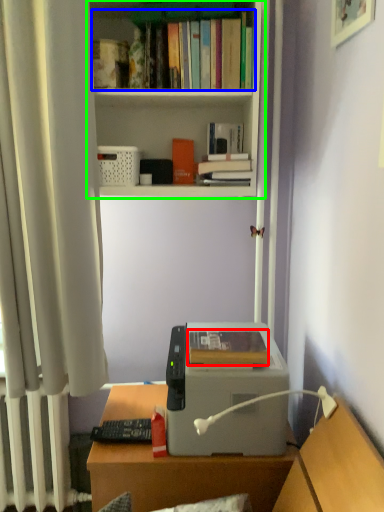
Question: Which object is positioned farthest from book (highlighted by a red box)? Select from book (highlighted by a blue box) and bookcase (highlighted by a green box).

Choices:
 (A) book
 (B) bookcase

Answer: (A)